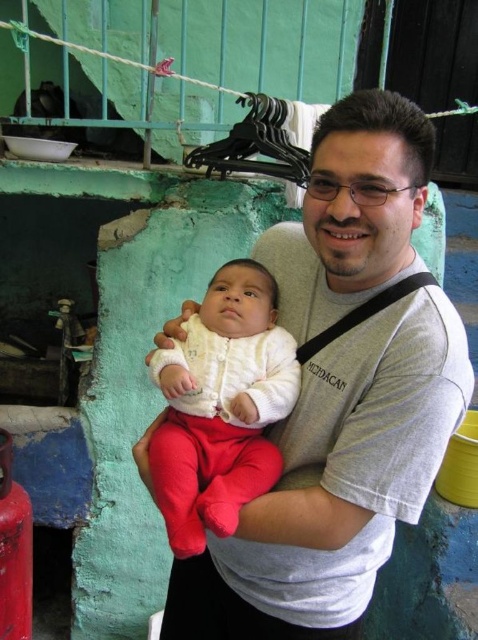
You are a photographer trying to capture a closeup of the gray cotton shirt at center and the white soft baby at center. Since the camera can only focus on one subject at a time, which one should you focus on to ensure the other is still in the frame?

The gray cotton shirt at center is located below the white soft baby at center, so focusing on the white soft baby at center will keep the gray cotton shirt at center in the frame as it is positioned lower.

You are standing in front of the man holding the baby and want to place a small gift at point A and a large gift at point B. Given that point A is at coordinates point(426, 148) and point B is at point(161, 369), which gift should you place closer to you?

Since point A is closer to the viewer than point B, you should place the small gift at point A closer to you and the large gift at point B further away.